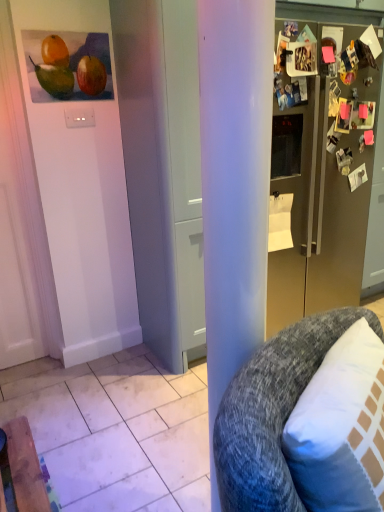
Describe the element at coordinates (272, 412) in the screenshot. This screenshot has width=384, height=512. I see `gray textured cushion at right` at that location.

This screenshot has width=384, height=512. Describe the element at coordinates (163, 168) in the screenshot. I see `white matte door at center` at that location.

What do you see at coordinates (68, 66) in the screenshot? The image size is (384, 512). I see `matte orange at upper left` at bounding box center [68, 66].

What is the approximate height of matte orange at upper left?

13.46 inches.

The width and height of the screenshot is (384, 512). In order to click on gray textured cushion at right in this screenshot , I will do `click(272, 412)`.

From the image's perspective, is white matte door at center located above or below satin gold refrigerator at right?

white matte door at center is situated lower than satin gold refrigerator at right in the image.

In the scene shown: Is white matte door at center to the left or to the right of satin gold refrigerator at right in the image?

white matte door at center is positioned on satin gold refrigerator at right's left side.

How different are the orientations of white matte door at center and satin gold refrigerator at right in degrees?

The angle between the facing direction of white matte door at center and the facing direction of satin gold refrigerator at right is 0.000755 degrees.

From a real-world perspective, which object stands above the other?

satin gold refrigerator at right, from a real-world perspective.

How distant is matte orange at upper left from white matte door at center?

matte orange at upper left and white matte door at center are 17.81 inches apart.

Does matte orange at upper left have a larger size compared to white matte door at center?

Actually, matte orange at upper left might be smaller than white matte door at center.

Considering the positions of point (77, 44) and point (171, 326), is point (77, 44) closer or farther from the camera than point (171, 326)?

Point (77, 44) appears to be closer to the viewer than point (171, 326).

Would you say matte orange at upper left is to the left or to the right of satin gold refrigerator at right in the picture?

matte orange at upper left is to the left of satin gold refrigerator at right.

Would you consider matte orange at upper left to be distant from satin gold refrigerator at right?

Yes, matte orange at upper left and satin gold refrigerator at right are quite far apart.

Is gray textured cushion at right oriented towards matte orange at upper left?

No, gray textured cushion at right is not turned towards matte orange at upper left.

Based on the photo, from the image's perspective, between gray textured cushion at right and matte orange at upper left, who is located below?

From the image's view, gray textured cushion at right is below.

Find the location of a particular element. The width and height of the screenshot is (384, 512). fruit on the left of the gray textured cushion at right is located at coordinates (68, 66).

Choose the correct answer: Is gray textured cushion at right inside matte orange at upper left or outside it?

gray textured cushion at right is located beyond the bounds of matte orange at upper left.

How distant is white matte door at center from gray textured cushion at right?

white matte door at center is 4.01 feet from gray textured cushion at right.

From the image's perspective, is white matte door at center above or below gray textured cushion at right?

white matte door at center is situated higher than gray textured cushion at right in the image.

Can you confirm if white matte door at center is smaller than gray textured cushion at right?

Incorrect, white matte door at center is not smaller in size than gray textured cushion at right.

Consider the image. Considering the relative positions of satin gold refrigerator at right and gray textured cushion at right in the image provided, is satin gold refrigerator at right to the right of gray textured cushion at right from the viewer's perspective?

Yes.

From a real-world perspective, who is located lower, satin gold refrigerator at right or gray textured cushion at right?

gray textured cushion at right is physically lower.

Is satin gold refrigerator at right oriented away from gray textured cushion at right?

satin gold refrigerator at right is not turned away from gray textured cushion at right.

Is there a large distance between white matte door at center and matte orange at upper left?

They are positioned close to each other.

Is white matte door at center facing towards matte orange at upper left?

No, white matte door at center is not aimed at matte orange at upper left.

From the image's perspective, which object appears higher, white matte door at center or matte orange at upper left?

From the image's view, matte orange at upper left is above.

I want to click on fruit above the white matte door at center (from a real-world perspective), so click(68, 66).

Identify the location of refrigerator lying above the white matte door at center (from the image's perspective). This screenshot has width=384, height=512. (317, 219).

You are a GUI agent. You are given a task and a screenshot of the screen. Output one action in this format:
    pyautogui.click(x=<x>, y=<y>)
    Task: Click on the door in front of the matte orange at upper left
    This screenshot has height=512, width=384.
    Given the screenshot: What is the action you would take?
    pyautogui.click(x=163, y=168)

Looking at the image, which one is located further to white matte door at center, matte orange at upper left or satin gold refrigerator at right?

The object further to white matte door at center is satin gold refrigerator at right.

Looking at the image, which one is located closer to white matte door at center, matte orange at upper left or gray textured cushion at right?

Among the two, matte orange at upper left is located nearer to white matte door at center.

Looking at the image, which one is located further to matte orange at upper left, gray textured cushion at right or white matte door at center?

Among the two, gray textured cushion at right is located further to matte orange at upper left.

Consider the image. When comparing their distances from satin gold refrigerator at right, does matte orange at upper left or white matte door at center seem further?

The object further to satin gold refrigerator at right is matte orange at upper left.

When comparing their distances from satin gold refrigerator at right, does white matte door at center or matte orange at upper left seem closer?

white matte door at center is closer to satin gold refrigerator at right.

Looking at the image, which one is located further to matte orange at upper left, white matte door at center or satin gold refrigerator at right?

Based on the image, satin gold refrigerator at right appears to be further to matte orange at upper left.

Considering their positions, is white matte door at center positioned further to gray textured cushion at right than matte orange at upper left?

matte orange at upper left lies further to gray textured cushion at right than the other object.

Looking at the image, which one is located further to white matte door at center, satin gold refrigerator at right or matte orange at upper left?

satin gold refrigerator at right is further to white matte door at center.

Identify the location of door positioned between gray textured cushion at right and satin gold refrigerator at right from near to far. coord(163,168).

The height and width of the screenshot is (512, 384). Identify the location of refrigerator located between gray textured cushion at right and matte orange at upper left in the depth direction. 317,219.

The image size is (384, 512). Identify the location of door between matte orange at upper left and satin gold refrigerator at right. (163, 168).

The height and width of the screenshot is (512, 384). In order to click on door located between gray textured cushion at right and matte orange at upper left in the depth direction in this screenshot , I will do `click(163, 168)`.